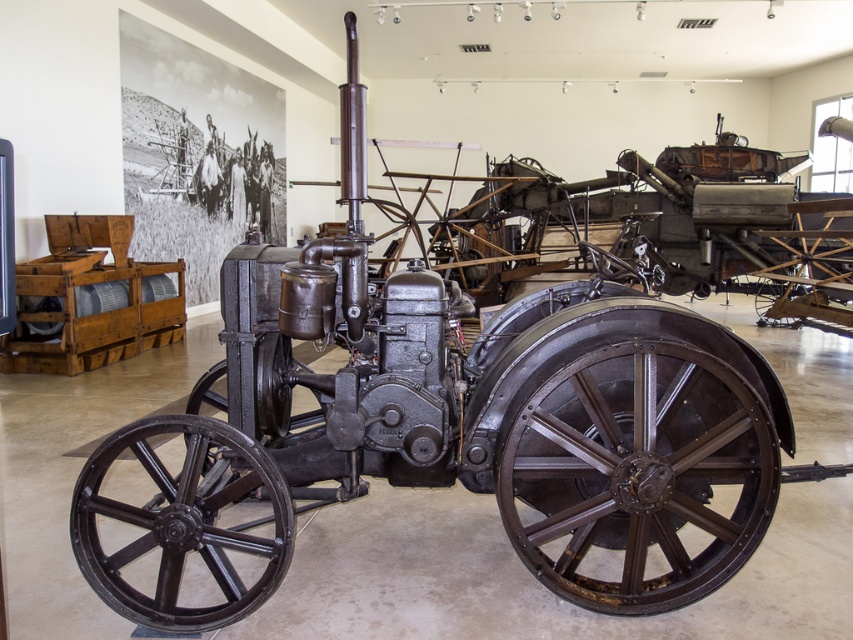
Question: Estimate the real-world distances between objects in this image. Which object is closer to the rusty metal wheel at center?

Choices:
 (A) black cast iron wheel at center
 (B) dark brown metal wheel at center

Answer: (A)

Question: Which of these objects is positioned closest to the dark brown metal wheel at center?

Choices:
 (A) black cast iron wheel at center
 (B) rusty metal wheel at center

Answer: (B)

Question: Is rusty metal wheel at center thinner than dark brown metal wheel at center?

Choices:
 (A) yes
 (B) no

Answer: (A)

Question: Can you confirm if black cast iron wheel at center is thinner than dark brown metal wheel at center?

Choices:
 (A) no
 (B) yes

Answer: (A)

Question: Can you confirm if black cast iron wheel at center is positioned to the right of dark brown metal wheel at center?

Choices:
 (A) no
 (B) yes

Answer: (A)

Question: Which point is closer to the camera taking this photo?

Choices:
 (A) click(x=764, y=316)
 (B) click(x=97, y=460)

Answer: (B)